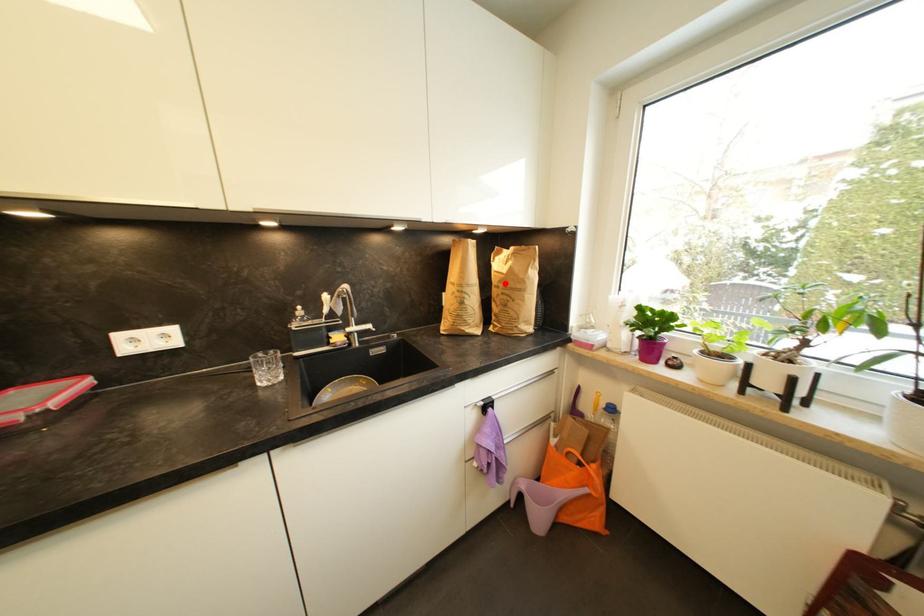
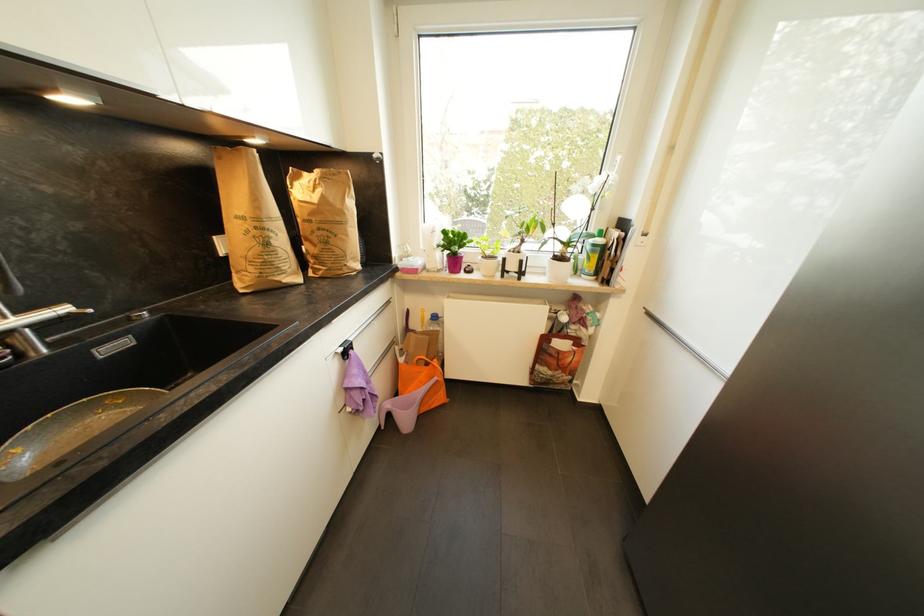
The point at the highlighted location is marked in the first image. Where is the corresponding point in the second image?

(317, 216)